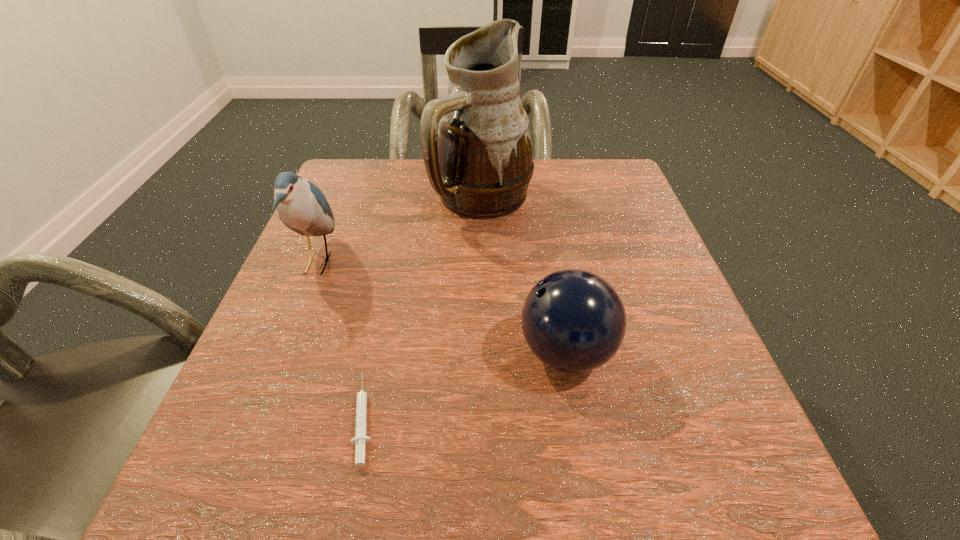
This screenshot has height=540, width=960. Identify the location of vacant space located 0.330m on the surface of the second shortest object near the finger holes. pyautogui.click(x=306, y=352).

You are a GUI agent. You are given a task and a screenshot of the screen. Output one action in this format:
    pyautogui.click(x=<x>, y=<y>)
    Task: Click on the free location located on the surface of the second shortest object near the finger holes
    The width and height of the screenshot is (960, 540).
    Given the screenshot: What is the action you would take?
    click(x=306, y=352)

Identify the location of free space located 0.120m on the back of the third object from right to left. (386, 315).

Find the location of a particular element. object at the far edge is located at coordinates (476, 146).

This screenshot has width=960, height=540. Identify the location of object present at the near edge. (360, 439).

At what (x,y) coordinates should I click in order to perform the action: click on object situated at the left edge. Please return your answer as a coordinate pair (x, y). The height and width of the screenshot is (540, 960). Looking at the image, I should click on (302, 207).

Identify the location of object that is at the right edge. (574, 321).

The image size is (960, 540). In order to click on free region at the far edge of the desktop in this screenshot , I will do `click(552, 203)`.

In the image, there is a desktop. At what (x,y) coordinates should I click in order to perform the action: click on vacant space at the near edge. Please return your answer as a coordinate pair (x, y). Looking at the image, I should click on (514, 498).

Identify the location of vacant point at the left edge. pyautogui.click(x=304, y=275).